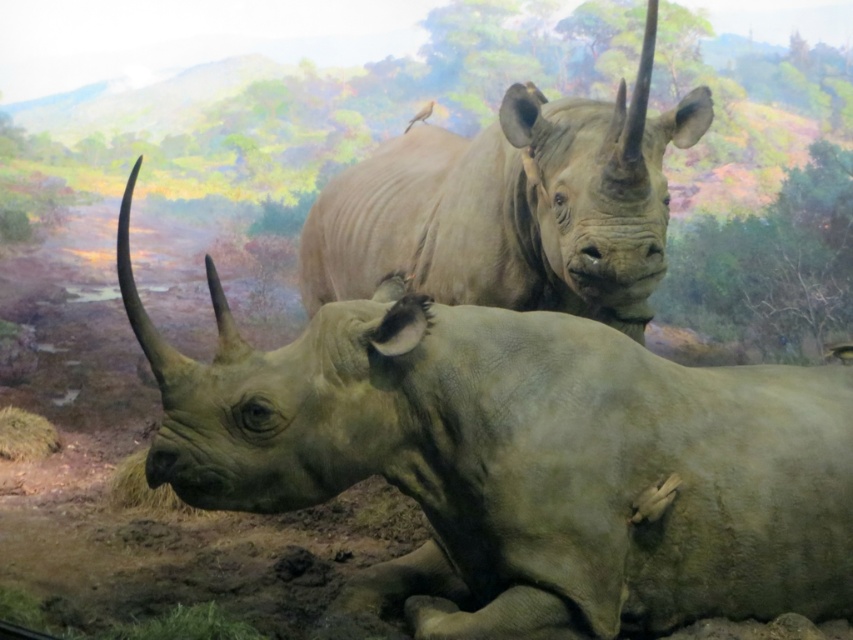
Between matte gray rhinoceros at center and matte gray rhinoceros at upper center, which one has less height?

matte gray rhinoceros at upper center is shorter.

Is point (589, 401) in front of point (409, 138)?

Yes, it is.

Identify the location of matte gray rhinoceros at center. This screenshot has height=640, width=853. (523, 460).